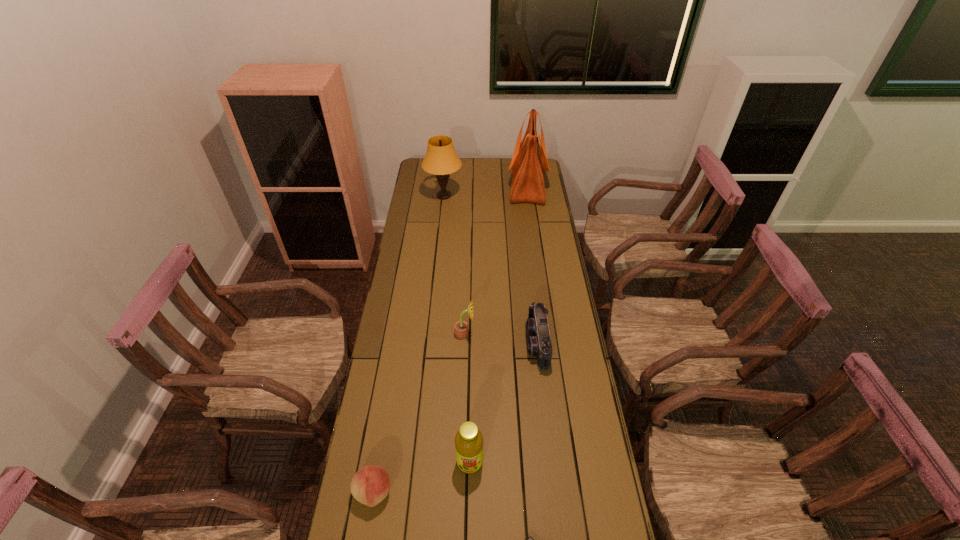
What are the coordinates of `free space located on the front-facing side of the third shortest object` in the screenshot? It's located at (487, 344).

Where is `free space located on the front-facing side of the third shortest object`? free space located on the front-facing side of the third shortest object is located at coordinates (452, 344).

Locate an element on the screen. This screenshot has height=540, width=960. vacant space located on the front-facing side of the third shortest object is located at coordinates (439, 344).

The image size is (960, 540). What are the coordinates of `vacant space located 0.100m on the back of the peach` in the screenshot? It's located at (382, 442).

Where is `object located at the far edge`? This screenshot has width=960, height=540. object located at the far edge is located at coordinates (529, 161).

The image size is (960, 540). Identify the location of lampshade present at the left edge. (441, 159).

This screenshot has height=540, width=960. I want to click on peach at the left edge, so click(370, 485).

I want to click on shopping bag present at the right edge, so click(529, 161).

The height and width of the screenshot is (540, 960). What are the coordinates of `camcorder located at the right edge` in the screenshot? It's located at (539, 344).

Where is `object that is at the far right corner`? The image size is (960, 540). object that is at the far right corner is located at coordinates (529, 161).